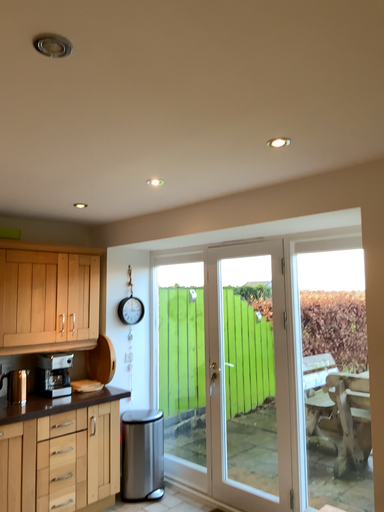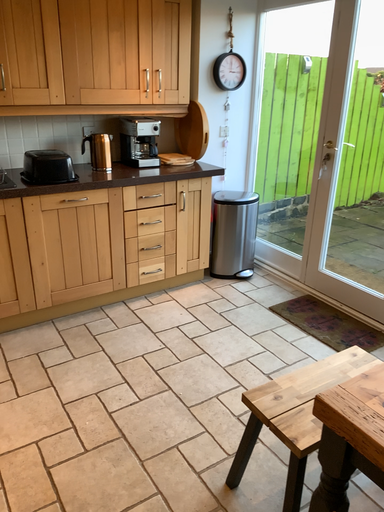
Question: Which way did the camera rotate in the video?

Choices:
 (A) rotated left
 (B) rotated right

Answer: (A)